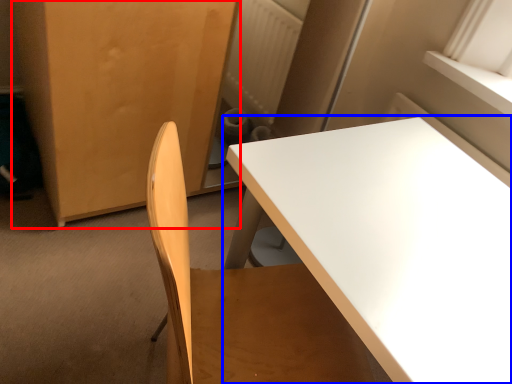
Question: Which object appears farthest to the camera in this image, armoire (highlighted by a red box) or table (highlighted by a blue box)?

Choices:
 (A) armoire
 (B) table

Answer: (A)